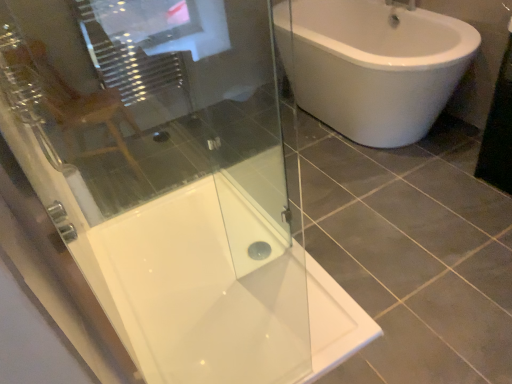
Question: Is matte wooden chair at upper left shorter than white glossy shower tray at center?

Choices:
 (A) yes
 (B) no

Answer: (B)

Question: Does matte wooden chair at upper left appear on the left side of white glossy shower tray at center?

Choices:
 (A) yes
 (B) no

Answer: (A)

Question: Considering the relative positions of matte wooden chair at upper left and white glossy shower tray at center in the image provided, is matte wooden chair at upper left in front of white glossy shower tray at center?

Choices:
 (A) no
 (B) yes

Answer: (A)

Question: Can you confirm if matte wooden chair at upper left is smaller than white glossy shower tray at center?

Choices:
 (A) yes
 (B) no

Answer: (B)

Question: From a real-world perspective, is matte wooden chair at upper left on white glossy shower tray at center?

Choices:
 (A) yes
 (B) no

Answer: (A)

Question: Does matte wooden chair at upper left have a greater height compared to white glossy shower tray at center?

Choices:
 (A) yes
 (B) no

Answer: (A)

Question: Does white glossy shower tray at center lie behind transparent glass shower door at upper left?

Choices:
 (A) yes
 (B) no

Answer: (A)

Question: Is white glossy shower tray at center located outside transparent glass shower door at upper left?

Choices:
 (A) no
 (B) yes

Answer: (B)

Question: Would you say white glossy shower tray at center is a long distance from transparent glass shower door at upper left?

Choices:
 (A) yes
 (B) no

Answer: (B)

Question: Is white glossy shower tray at center next to transparent glass shower door at upper left and touching it?

Choices:
 (A) no
 (B) yes

Answer: (A)

Question: Considering the relative positions of white glossy shower tray at center and transparent glass shower door at upper left in the image provided, is white glossy shower tray at center to the left of transparent glass shower door at upper left from the viewer's perspective?

Choices:
 (A) yes
 (B) no

Answer: (A)

Question: Considering the relative positions of white glossy shower tray at center and transparent glass shower door at upper left in the image provided, is white glossy shower tray at center in front of transparent glass shower door at upper left?

Choices:
 (A) no
 (B) yes

Answer: (A)

Question: Is transparent glass shower door at upper left turned away from white glossy shower tray at center?

Choices:
 (A) no
 (B) yes

Answer: (A)